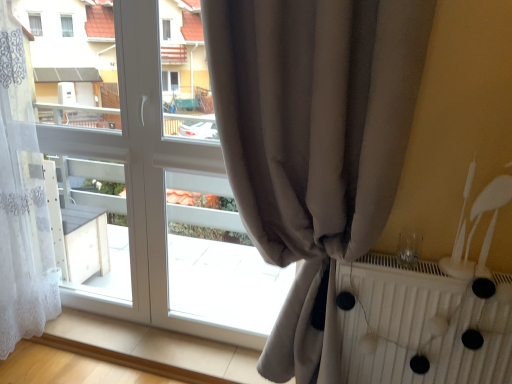
Where is `white textured radiator at right`? white textured radiator at right is located at coordinates (420, 326).

What is the approximate height of white textured radiator at right?

white textured radiator at right is 22.47 inches in height.

Describe the element at coordinates (22, 202) in the screenshot. This screenshot has height=384, width=512. I see `white sheer curtain at left, placed as the 2th curtain when sorted from right to left` at that location.

Describe the element at coordinates (314, 144) in the screenshot. I see `satin beige curtain at center, which is the first curtain in right-to-left order` at that location.

You are a GUI agent. You are given a task and a screenshot of the screen. Output one action in this format:
    pyautogui.click(x=<x>, y=<y>)
    Task: Click on the white textured radiator at right
    The height and width of the screenshot is (384, 512).
    Given the screenshot: What is the action you would take?
    pyautogui.click(x=420, y=326)

Is satin beige curtain at center, which is the first curtain in right-to-left order, inside or outside of white textured radiator at right?

satin beige curtain at center, which is the first curtain in right-to-left order, is not enclosed by white textured radiator at right.

Which is in front, point (281, 334) or point (344, 374)?

Positioned in front is point (344, 374).

Measure the distance from satin beige curtain at center, which is the first curtain in right-to-left order, to white textured radiator at right.

satin beige curtain at center, which is the first curtain in right-to-left order, is 13.95 inches from white textured radiator at right.

Can you see satin beige curtain at center, which is the first curtain in right-to-left order, touching white textured radiator at right?

satin beige curtain at center, which is the first curtain in right-to-left order, and white textured radiator at right are clearly separated.

Locate an element on the screen. The image size is (512, 384). curtain in front of the white sheer curtain at left, which is counted as the 1th curtain, starting from the left is located at coordinates (314, 144).

What's the angular difference between white sheer curtain at left, which is counted as the 1th curtain, starting from the left, and satin beige curtain at center, which is the first curtain in right-to-left order,'s facing directions?

The facing directions of white sheer curtain at left, which is counted as the 1th curtain, starting from the left, and satin beige curtain at center, which is the first curtain in right-to-left order, are 0.000167 degrees apart.

Is satin beige curtain at center, which is the first curtain in right-to-left order, completely or partially inside white sheer curtain at left, which is counted as the 1th curtain, starting from the left?

No, satin beige curtain at center, which is the first curtain in right-to-left order, is not a part of white sheer curtain at left, which is counted as the 1th curtain, starting from the left.

Could you measure the distance between white sheer curtain at left, which is counted as the 1th curtain, starting from the left, and satin beige curtain at center, placed as the second curtain when sorted from left to right?

3.82 feet.

Is white sheer curtain at left, placed as the 2th curtain when sorted from right to left, aimed at white textured radiator at right?

No, white sheer curtain at left, placed as the 2th curtain when sorted from right to left, is not turned towards white textured radiator at right.

Where is `radiator that appears below the white sheer curtain at left, placed as the 2th curtain when sorted from right to left (from a real-world perspective)`? The width and height of the screenshot is (512, 384). radiator that appears below the white sheer curtain at left, placed as the 2th curtain when sorted from right to left (from a real-world perspective) is located at coordinates 420,326.

Does white sheer curtain at left, which is counted as the 1th curtain, starting from the left, lie in front of white textured radiator at right?

No, white sheer curtain at left, which is counted as the 1th curtain, starting from the left, is behind white textured radiator at right.

Between white sheer curtain at left, which is counted as the 1th curtain, starting from the left, and white textured radiator at right, which one has less height?

Standing shorter between the two is white textured radiator at right.

The image size is (512, 384). What are the coordinates of `radiator below the white sheer curtain at left, which is counted as the 1th curtain, starting from the left (from a real-world perspective)` in the screenshot? It's located at (420, 326).

How different are the orientations of white textured radiator at right and white sheer curtain at left, placed as the 2th curtain when sorted from right to left, in degrees?

There is a 2.94-degree angle between the facing directions of white textured radiator at right and white sheer curtain at left, placed as the 2th curtain when sorted from right to left.

How distant is white textured radiator at right from white sheer curtain at left, placed as the 2th curtain when sorted from right to left?

1.56 meters.

Does white textured radiator at right appear on the right side of white sheer curtain at left, placed as the 2th curtain when sorted from right to left?

Indeed, white textured radiator at right is positioned on the right side of white sheer curtain at left, placed as the 2th curtain when sorted from right to left.

Between white textured radiator at right and satin beige curtain at center, which is the first curtain in right-to-left order, which one has less height?

With less height is white textured radiator at right.

Does white textured radiator at right lie behind satin beige curtain at center, placed as the second curtain when sorted from left to right?

Yes, white textured radiator at right is behind satin beige curtain at center, placed as the second curtain when sorted from left to right.

Is white textured radiator at right facing towards satin beige curtain at center, which is the first curtain in right-to-left order?

No, white textured radiator at right is not oriented towards satin beige curtain at center, which is the first curtain in right-to-left order.

Which is in front, point (464, 295) or point (275, 159)?

The point (275, 159) is closer.

Considering the positions of point (273, 62) and point (10, 122), is point (273, 62) closer or farther from the camera than point (10, 122)?

Point (273, 62) is closer to the camera than point (10, 122).

Which of these two, satin beige curtain at center, which is the first curtain in right-to-left order, or white sheer curtain at left, placed as the 2th curtain when sorted from right to left, stands shorter?

Standing shorter between the two is white sheer curtain at left, placed as the 2th curtain when sorted from right to left.

Are satin beige curtain at center, placed as the second curtain when sorted from left to right, and white sheer curtain at left, which is counted as the 1th curtain, starting from the left, beside each other?

satin beige curtain at center, placed as the second curtain when sorted from left to right, and white sheer curtain at left, which is counted as the 1th curtain, starting from the left, are clearly separated.

Which of these two, satin beige curtain at center, placed as the second curtain when sorted from left to right, or white sheer curtain at left, which is counted as the 1th curtain, starting from the left, is smaller?

satin beige curtain at center, placed as the second curtain when sorted from left to right.

The width and height of the screenshot is (512, 384). What are the coordinates of `radiator below the satin beige curtain at center, placed as the second curtain when sorted from left to right (from the image's perspective)` in the screenshot? It's located at [x=420, y=326].

Locate an element on the screen. The width and height of the screenshot is (512, 384). curtain behind the satin beige curtain at center, placed as the second curtain when sorted from left to right is located at coordinates (22, 202).

Considering their positions, is white textured radiator at right positioned further to satin beige curtain at center, which is the first curtain in right-to-left order, than white sheer curtain at left, which is counted as the 1th curtain, starting from the left?

white sheer curtain at left, which is counted as the 1th curtain, starting from the left.

From the image, which object appears to be nearer to white textured radiator at right, white sheer curtain at left, placed as the 2th curtain when sorted from right to left, or satin beige curtain at center, placed as the second curtain when sorted from left to right?

satin beige curtain at center, placed as the second curtain when sorted from left to right.

Which object lies further to the anchor point satin beige curtain at center, which is the first curtain in right-to-left order, white sheer curtain at left, placed as the 2th curtain when sorted from right to left, or white textured radiator at right?

Among the two, white sheer curtain at left, placed as the 2th curtain when sorted from right to left, is located further to satin beige curtain at center, which is the first curtain in right-to-left order.

Based on their spatial positions, is satin beige curtain at center, which is the first curtain in right-to-left order, or white textured radiator at right closer to white sheer curtain at left, which is counted as the 1th curtain, starting from the left?

satin beige curtain at center, which is the first curtain in right-to-left order, is closer to white sheer curtain at left, which is counted as the 1th curtain, starting from the left.

Estimate the real-world distances between objects in this image. Which object is further from white sheer curtain at left, which is counted as the 1th curtain, starting from the left, white textured radiator at right or satin beige curtain at center, which is the first curtain in right-to-left order?

white textured radiator at right is positioned further to the anchor white sheer curtain at left, which is counted as the 1th curtain, starting from the left.

From the image, which object appears to be farther from white textured radiator at right, satin beige curtain at center, placed as the second curtain when sorted from left to right, or white sheer curtain at left, placed as the 2th curtain when sorted from right to left?

The object further to white textured radiator at right is white sheer curtain at left, placed as the 2th curtain when sorted from right to left.

Identify the location of curtain between white sheer curtain at left, placed as the 2th curtain when sorted from right to left, and white textured radiator at right from left to right. Image resolution: width=512 pixels, height=384 pixels. (314, 144).